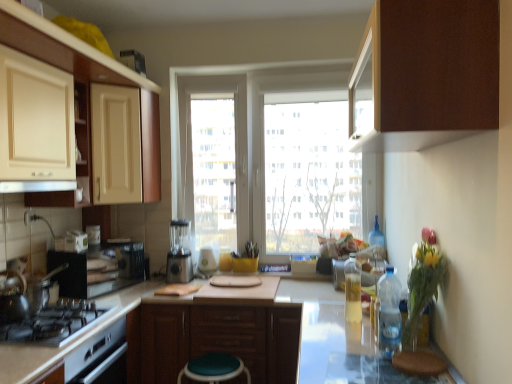
Question: Is clear plastic bottle at center, which is counted as the third bottle, starting from the right, in contact with matte cream cabinet at upper left, the 1th shelf positioned from the left?

Choices:
 (A) yes
 (B) no

Answer: (B)

Question: From a real-world perspective, is clear plastic bottle at center, which is the 2th bottle from front to back, physically below matte cream cabinet at upper left, which is the second shelf in right-to-left order?

Choices:
 (A) no
 (B) yes

Answer: (B)

Question: From the image's perspective, is clear plastic bottle at center, which is counted as the third bottle, starting from the right, above matte cream cabinet at upper left, the 1th shelf positioned from the left?

Choices:
 (A) yes
 (B) no

Answer: (B)

Question: Is clear plastic bottle at center, which is the 2th bottle from front to back, located outside matte cream cabinet at upper left, which is the second shelf in right-to-left order?

Choices:
 (A) no
 (B) yes

Answer: (B)

Question: Considering the relative sizes of clear plastic bottle at center, which is counted as the third bottle, starting from the right, and matte cream cabinet at upper left, the 1th shelf positioned from the left, in the image provided, is clear plastic bottle at center, which is counted as the third bottle, starting from the right, bigger than matte cream cabinet at upper left, the 1th shelf positioned from the left,?

Choices:
 (A) no
 (B) yes

Answer: (A)

Question: Is clear plastic bottle at center, the third bottle from the back, facing away from matte cream cabinet at upper left, the 1th shelf positioned from the left?

Choices:
 (A) no
 (B) yes

Answer: (A)

Question: Is translucent plastic bottle at center, the 1th bottle viewed from the back, smaller than brown fabric step stool at lower right, acting as the second step stool starting from the bottom?

Choices:
 (A) no
 (B) yes

Answer: (B)

Question: Can you confirm if translucent plastic bottle at center, the first bottle positioned from the left, is bigger than brown fabric step stool at lower right, which is the first step stool in right-to-left order?

Choices:
 (A) yes
 (B) no

Answer: (B)

Question: From a real-world perspective, is translucent plastic bottle at center, the fourth bottle viewed from the right, under brown fabric step stool at lower right, which is the first step stool in right-to-left order?

Choices:
 (A) yes
 (B) no

Answer: (B)

Question: Is translucent plastic bottle at center, the first bottle positioned from the left, further to the viewer compared to brown fabric step stool at lower right, acting as the second step stool starting from the bottom?

Choices:
 (A) no
 (B) yes

Answer: (B)

Question: Is translucent plastic bottle at center, the 1th bottle viewed from the back, to the right of brown fabric step stool at lower right, acting as the second step stool starting from the bottom, from the viewer's perspective?

Choices:
 (A) yes
 (B) no

Answer: (B)

Question: Can brown fabric step stool at lower right, acting as the second step stool starting from the bottom, be found inside translucent plastic bottle at center, the first bottle positioned from the left?

Choices:
 (A) no
 (B) yes

Answer: (A)

Question: From a real-world perspective, is white glossy exhaust hood at upper center physically above black matte gas stove at lower left?

Choices:
 (A) yes
 (B) no

Answer: (A)